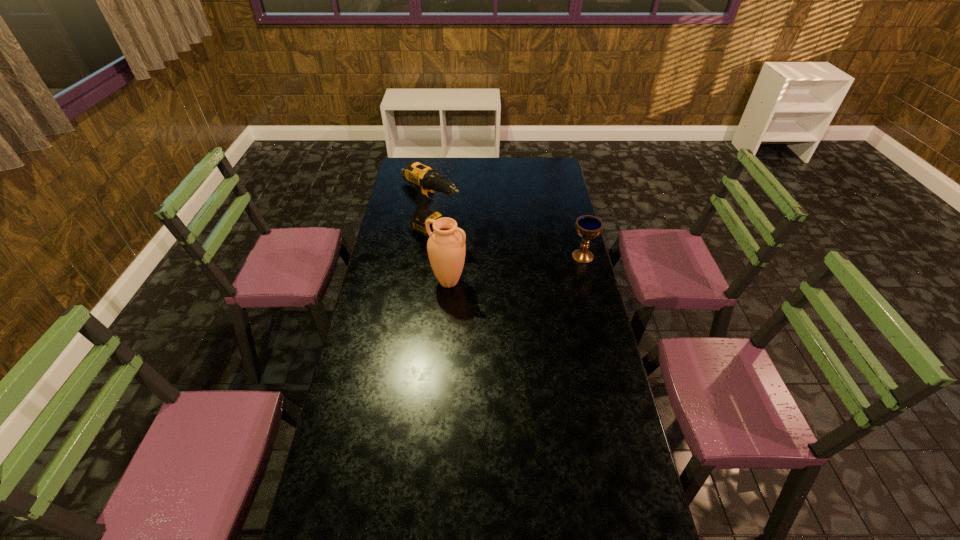
Find the location of `vacant space at the left edge of the desktop`. vacant space at the left edge of the desktop is located at coordinates (387, 399).

In order to click on vacant space at the right edge in this screenshot , I will do `click(601, 408)`.

Where is `free space at the far right corner of the desktop`? free space at the far right corner of the desktop is located at coordinates (551, 163).

Locate an element on the screen. The height and width of the screenshot is (540, 960). vacant space at the near right corner is located at coordinates (601, 524).

Locate an element on the screen. vacant space that's between the third farthest object and the electric shaver is located at coordinates (499, 222).

The width and height of the screenshot is (960, 540). I want to click on free space between the nearest object and the rightmost object, so click(x=516, y=269).

In order to click on vacant point located between the second shortest object and the shortest object in this screenshot , I will do `click(499, 222)`.

Identify the location of unoccupied position between the second shortest object and the third nearest object. (509, 244).

Locate an element on the screen. The image size is (960, 540). free spot between the second nearest object and the drill is located at coordinates (509, 244).

At what (x,y) coordinates should I click in order to perform the action: click on object that stands as the closest to the third tallest object. Please return your answer as a coordinate pair (x, y). The height and width of the screenshot is (540, 960). Looking at the image, I should click on (446, 247).